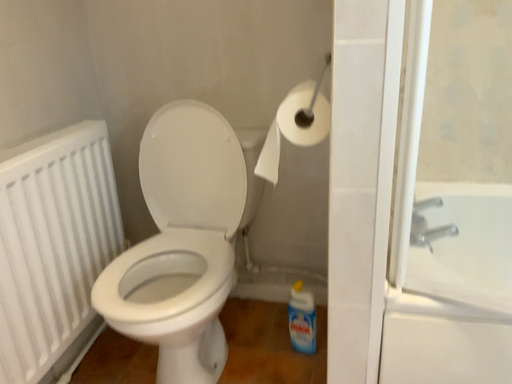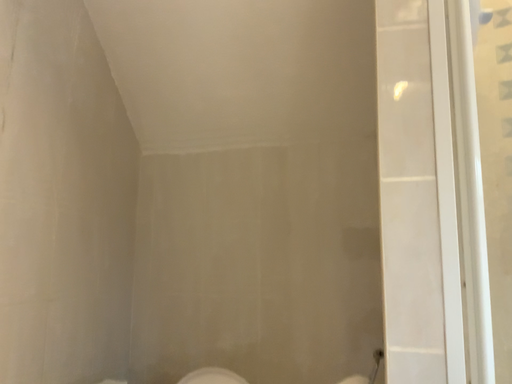
Question: Which way did the camera rotate in the video?

Choices:
 (A) rotated upward
 (B) rotated downward

Answer: (A)